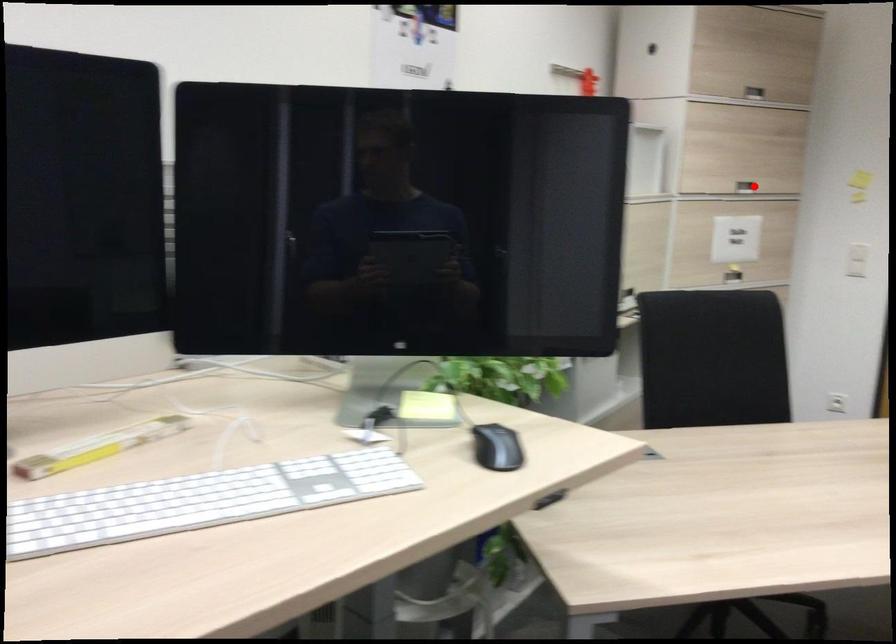
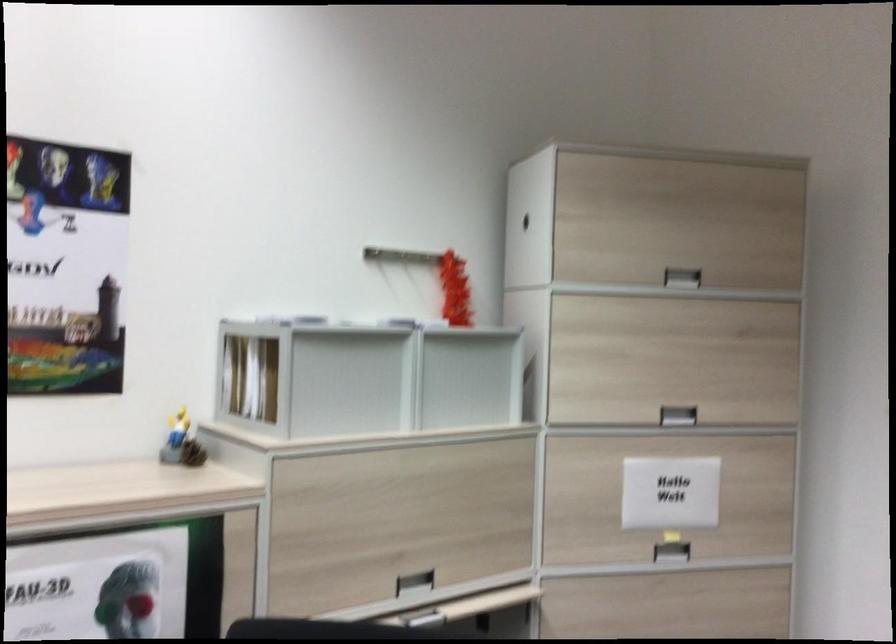
Question: I am providing you with two images of the same scene from different viewpoints. In image1, a red point is highlighted. Considering the same 3D point in image2, which of the following is correct?

Choices:
 (A) It is closer
 (B) It is farther

Answer: (A)